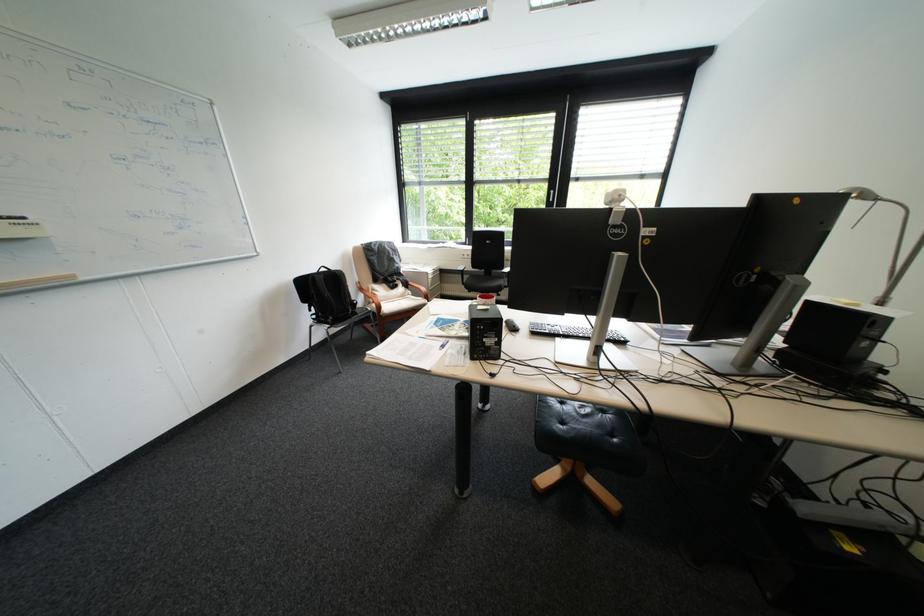
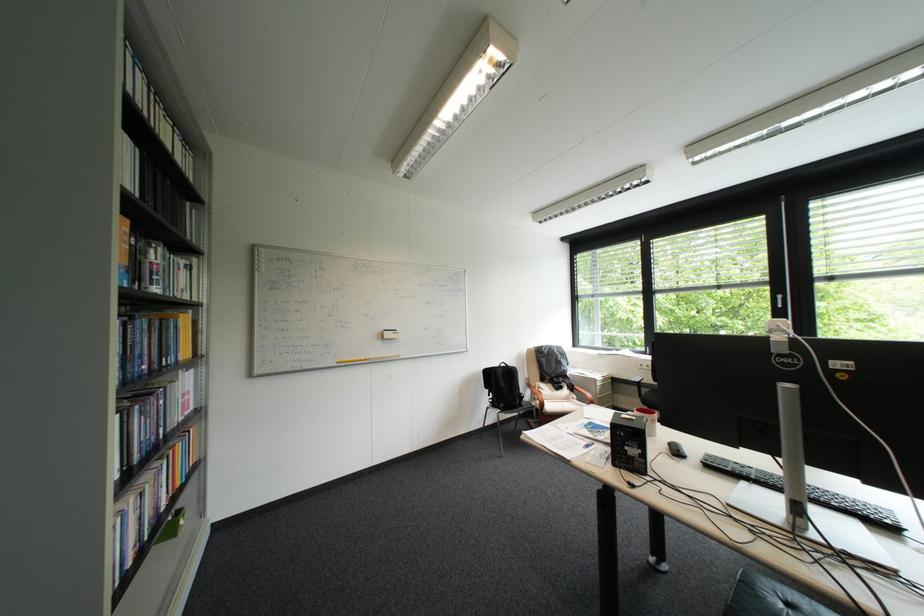
The point at (315, 302) is marked in the first image. Where is the corresponding point in the second image?

(497, 387)